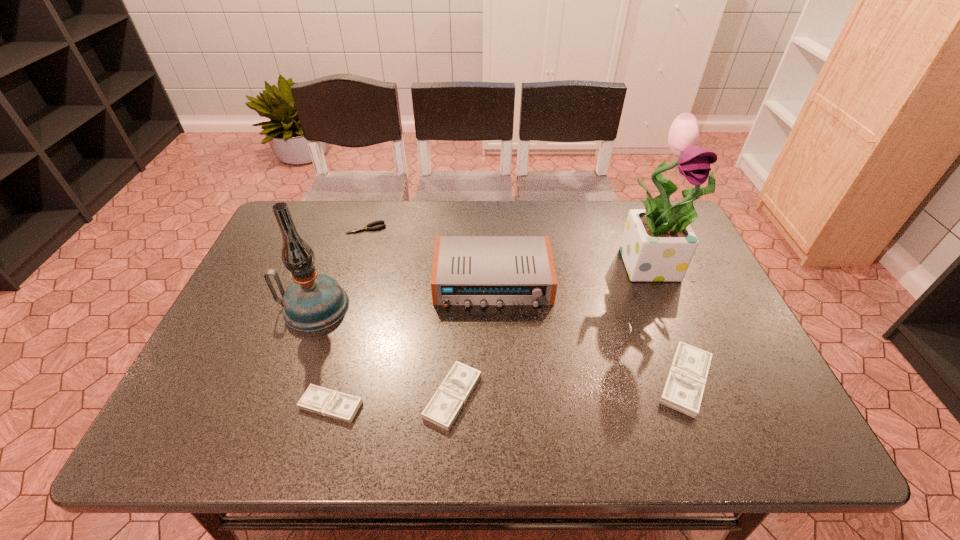
To make them evenly spaced by inserting another money among them, please locate a free space for this new money. Please provide its 2D coordinates. Your answer should be formatted as a tuple, i.e. [(x, y)], where the tuple contains the x and y coordinates of a point satisfying the conditions above.

[(570, 388)]